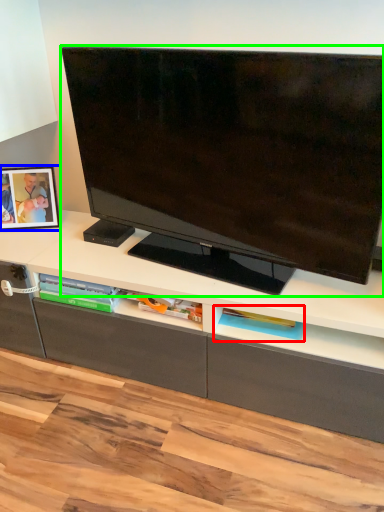
Question: Which object is positioned closest to shelf (highlighted by a red box)? Select from picture frame (highlighted by a blue box) and television (highlighted by a green box).

Choices:
 (A) picture frame
 (B) television

Answer: (B)